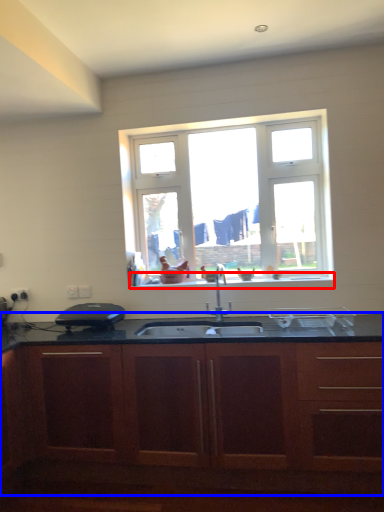
Question: Which object is closer to the camera taking this photo, window sill (highlighted by a red box) or cabinetry (highlighted by a blue box)?

Choices:
 (A) window sill
 (B) cabinetry

Answer: (B)